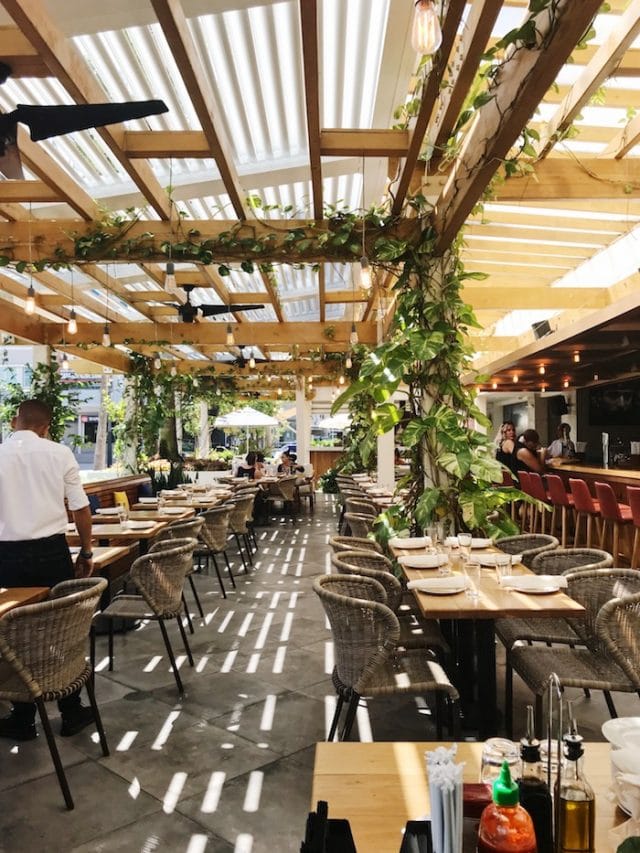
This screenshot has height=853, width=640. I want to click on table, so click(x=385, y=799).